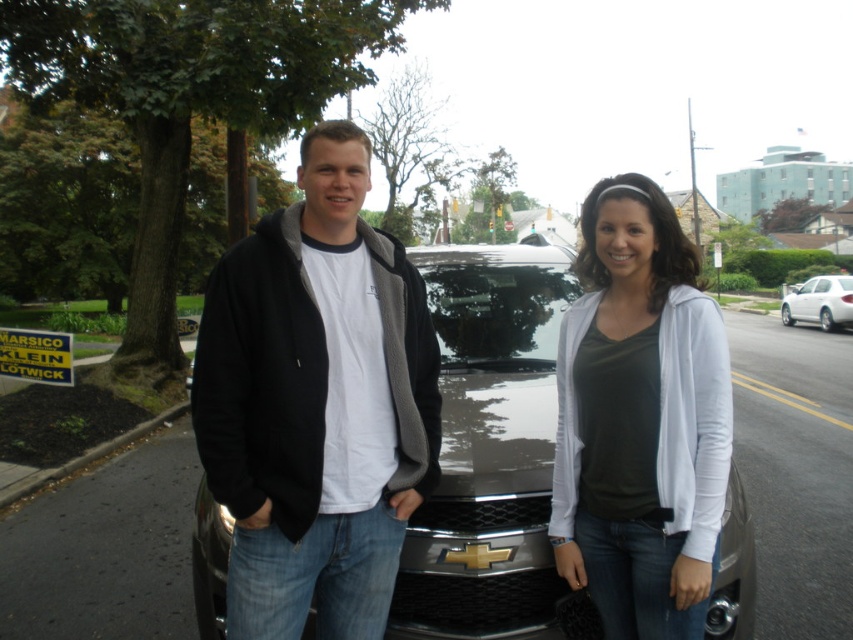
You are a photographer trying to capture a clear photo of both the black fleece jacket at center and the white soft sweater at center. Since you want both items to be in focus, which one should you adjust your camera focus on first?

You should focus on the black fleece jacket at center first because it is closer to the viewer than the white soft sweater at center, so adjusting focus starting from the closer object ensures both can be in focus.

You are a photographer trying to capture a closeup of the black fleece jacket at center. The camera you are using has a focal length of 50mm. Given that the point at coordinates (316, 403) is where you want to focus, can you confirm if this point aligns with the position of the black fleece jacket at center?

Yes, the point at coordinates (316, 403) corresponds to the black fleece jacket at center, so focusing there will capture the jacket properly.